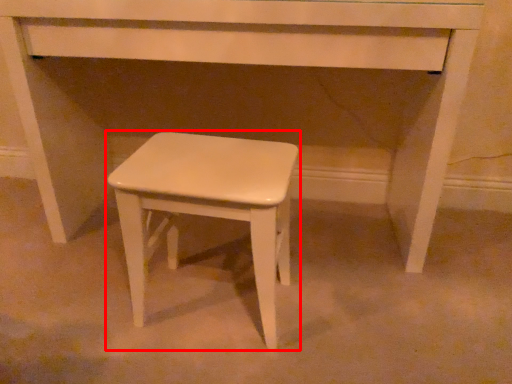
Question: Observing the image, what is the correct spatial positioning of stool (annotated by the red box) in reference to table?

Choices:
 (A) left
 (B) right

Answer: (A)